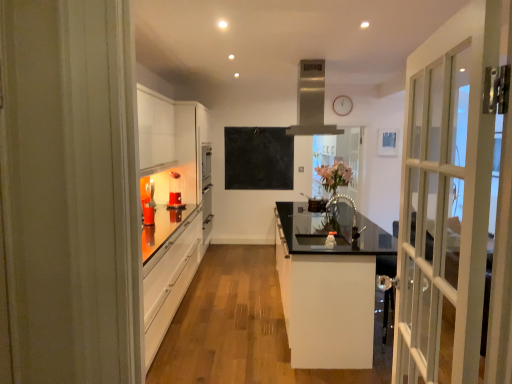
Question: From the image's perspective, would you say satin silver exhaust hood at upper center is shown under pink floral bouquet at center?

Choices:
 (A) yes
 (B) no

Answer: (B)

Question: Is satin silver exhaust hood at upper center to the left of pink floral bouquet at center from the viewer's perspective?

Choices:
 (A) no
 (B) yes

Answer: (B)

Question: Is satin silver exhaust hood at upper center located outside pink floral bouquet at center?

Choices:
 (A) no
 (B) yes

Answer: (B)

Question: From the image's perspective, is satin silver exhaust hood at upper center on top of pink floral bouquet at center?

Choices:
 (A) yes
 (B) no

Answer: (A)

Question: From a real-world perspective, is satin silver exhaust hood at upper center positioned under pink floral bouquet at center based on gravity?

Choices:
 (A) no
 (B) yes

Answer: (A)

Question: Is black matte chalkboard at center taller or shorter than satin silver exhaust hood at upper center?

Choices:
 (A) short
 (B) tall

Answer: (B)

Question: Visually, is black matte chalkboard at center positioned to the left or to the right of satin silver exhaust hood at upper center?

Choices:
 (A) left
 (B) right

Answer: (A)

Question: Based on their sizes in the image, would you say black matte chalkboard at center is bigger or smaller than satin silver exhaust hood at upper center?

Choices:
 (A) small
 (B) big

Answer: (A)

Question: From the image's perspective, relative to satin silver exhaust hood at upper center, is black matte chalkboard at center above or below?

Choices:
 (A) below
 (B) above

Answer: (A)

Question: Visually, is clear glass vase at center positioned to the left or to the right of pink floral bouquet at center?

Choices:
 (A) right
 (B) left

Answer: (A)

Question: Considering the positions of clear glass vase at center and pink floral bouquet at center in the image, is clear glass vase at center taller or shorter than pink floral bouquet at center?

Choices:
 (A) short
 (B) tall

Answer: (B)

Question: Does point (352, 145) appear closer or farther from the camera than point (331, 170)?

Choices:
 (A) closer
 (B) farther

Answer: (B)

Question: From the image's perspective, is clear glass vase at center located above or below pink floral bouquet at center?

Choices:
 (A) below
 (B) above

Answer: (B)

Question: Does point (335, 99) appear closer or farther from the camera than point (323, 172)?

Choices:
 (A) closer
 (B) farther

Answer: (A)

Question: Is white wooden clock at upper center situated inside pink floral bouquet at center or outside?

Choices:
 (A) inside
 (B) outside

Answer: (B)